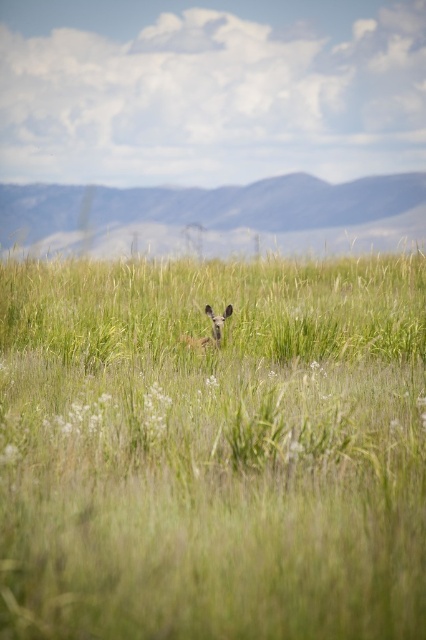
You are standing in the scene and want to find the deer hiding among the green grassy field at center. Based on the coordinates provided, where should you look to spot the deer?

The deer is located in the midground, partially obscured by the grasses. The green grassy field at center is at coordinates point (213,449), so you should look around that area to spot the deer.

You are standing in the field of tall grasses and wildflowers. You notice two points marked in the scene. Which point is closer to you, point [57,349] or point [204,340]?

Point [57,349] is closer to the viewer than point [204,340].

You are a wildlife photographer aiming to capture the brown furry deer at center without the green grassy field at center blocking the view. Can you adjust your camera angle to focus solely on the deer?

The green grassy field at center is wider than the brown furry deer at center, so adjusting the camera angle might still show some of the grassy field. However, zooming in could help focus more on the deer while minimizing the grassy field in the frame.